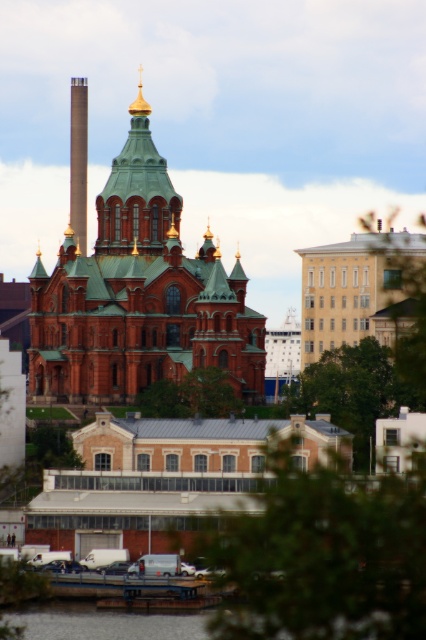
Can you confirm if white smooth building at center is positioned above green leafy tree at right?

No, white smooth building at center is not above green leafy tree at right.

Measure the distance between white smooth building at center and camera.

white smooth building at center and camera are 173.00 meters apart.

Image resolution: width=426 pixels, height=640 pixels. I want to click on white smooth building at center, so click(x=351, y=285).

Is green leafy tree at right taller than green leafy tree at center?

Yes.

Between green leafy tree at right and green leafy tree at center, which one is positioned lower?

green leafy tree at center

The height and width of the screenshot is (640, 426). Identify the location of green leafy tree at right. (403, 312).

In order to click on green leafy tree at right in this screenshot , I will do `click(403, 312)`.

Is white smooth building at center positioned in front of green leafy tree at lower right?

No, white smooth building at center is further to the viewer.

Is white smooth building at center bigger than green leafy tree at lower right?

Yes, white smooth building at center is bigger than green leafy tree at lower right.

Measure the distance between white smooth building at center and camera.

white smooth building at center and camera are 173.00 meters apart.

Where is `white smooth building at center`? white smooth building at center is located at coordinates (351, 285).